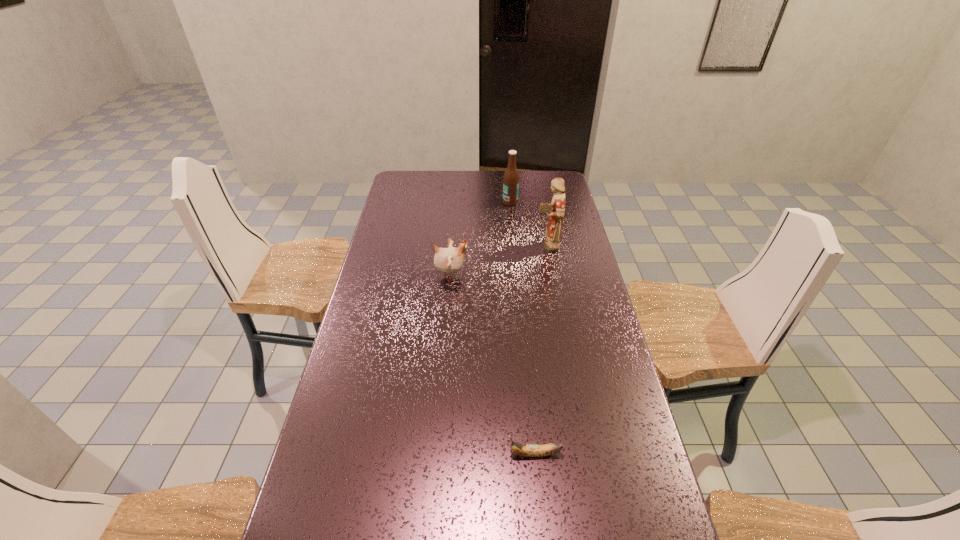
Identify the location of the second farthest object. (555, 211).

The image size is (960, 540). Find the location of `the tallest object`. the tallest object is located at coordinates (555, 211).

The height and width of the screenshot is (540, 960). What are the coordinates of `the farthest object` in the screenshot? It's located at (511, 176).

Locate an element on the screen. The image size is (960, 540). beer bottle is located at coordinates (511, 176).

Where is `the leftmost object`? This screenshot has width=960, height=540. the leftmost object is located at coordinates (448, 261).

You are a GUI agent. You are given a task and a screenshot of the screen. Output one action in this format:
    pyautogui.click(x=<x>, y=<y>)
    Task: Click on the third farthest object
    The width and height of the screenshot is (960, 540).
    Given the screenshot: What is the action you would take?
    pyautogui.click(x=448, y=261)

The width and height of the screenshot is (960, 540). Identify the location of banana. click(527, 450).

Locate an element on the screen. This screenshot has width=960, height=540. the shortest object is located at coordinates (527, 450).

Locate an element on the screen. free location located on the front-facing side of the figurine is located at coordinates (440, 246).

Locate an element on the screen. This screenshot has height=540, width=960. free space located on the front-facing side of the figurine is located at coordinates (470, 246).